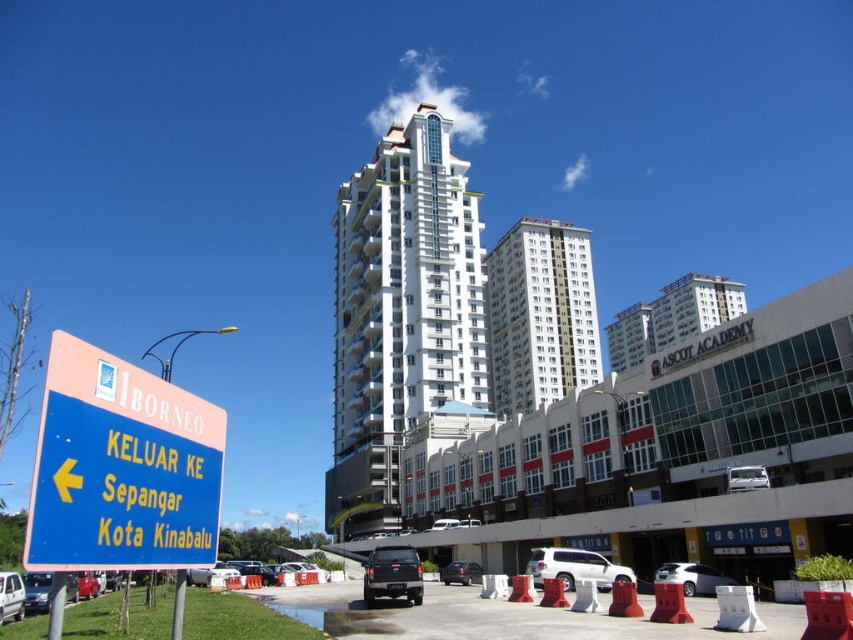
Question: Among these points, which one is farthest from the camera?

Choices:
 (A) (126, 376)
 (B) (230, 572)
 (C) (680, 577)

Answer: (B)

Question: Does matte black truck at center lie in front of matte black car at lower center?

Choices:
 (A) no
 (B) yes

Answer: (B)

Question: Estimate the real-world distances between objects in this image. Which object is closer to the white matte suv at center?

Choices:
 (A) matte black truck at center
 (B) red plastic cone at center

Answer: (B)

Question: Can you confirm if white glossy building at center is positioned to the left of white matte bus at center?

Choices:
 (A) no
 (B) yes

Answer: (B)

Question: Can you confirm if blue plastic sign at left is bigger than white matte suv at center?

Choices:
 (A) yes
 (B) no

Answer: (B)

Question: Which point is farther from the camera taking this photo?

Choices:
 (A) (10, 595)
 (B) (563, 586)
 (C) (723, 573)

Answer: (C)